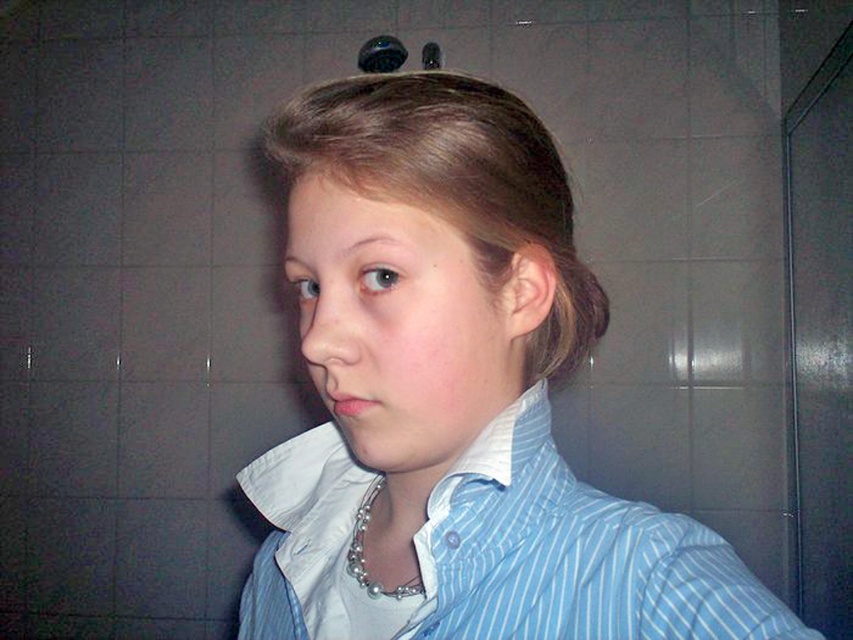
You are a photographer adjusting the lighting in the bathroom. You notice a shiny spot on the subject at point (567, 317). What object is causing this reflection?

The shiny spot at point (567, 317) is caused by the slightly shiny brown hair at ear.

You are a photographer setting up for a portrait in this bathroom scene. You need to ensure that the blue striped shirt at center and the blonde smooth hair at center are both visible in the frame. Based on their sizes, which object should you focus on first to ensure proper framing?

The blue striped shirt at center has a greater height compared to the blonde smooth hair at center, so you should focus on framing the blue striped shirt at center first to ensure it fits properly, after which the blonde smooth hair at center will naturally be included in the frame.